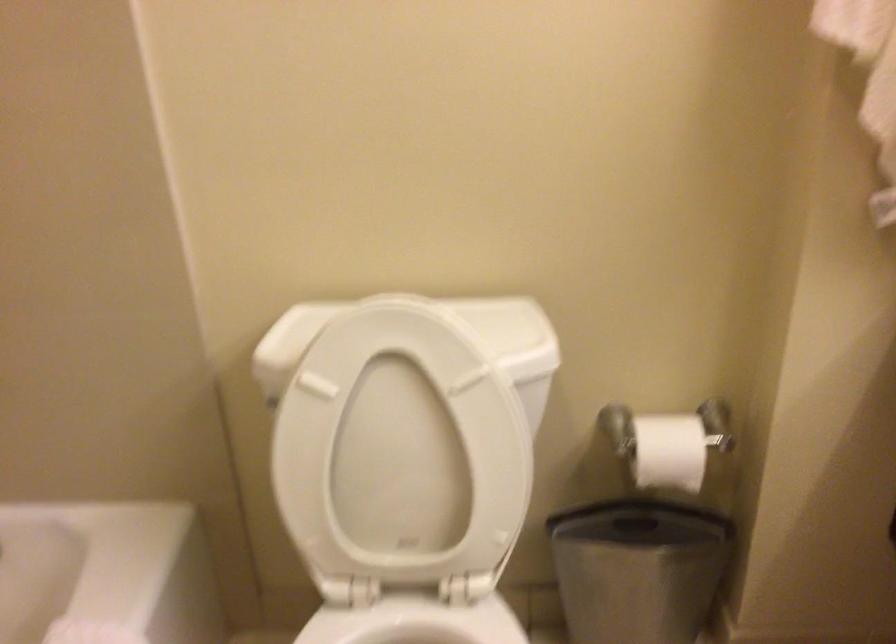
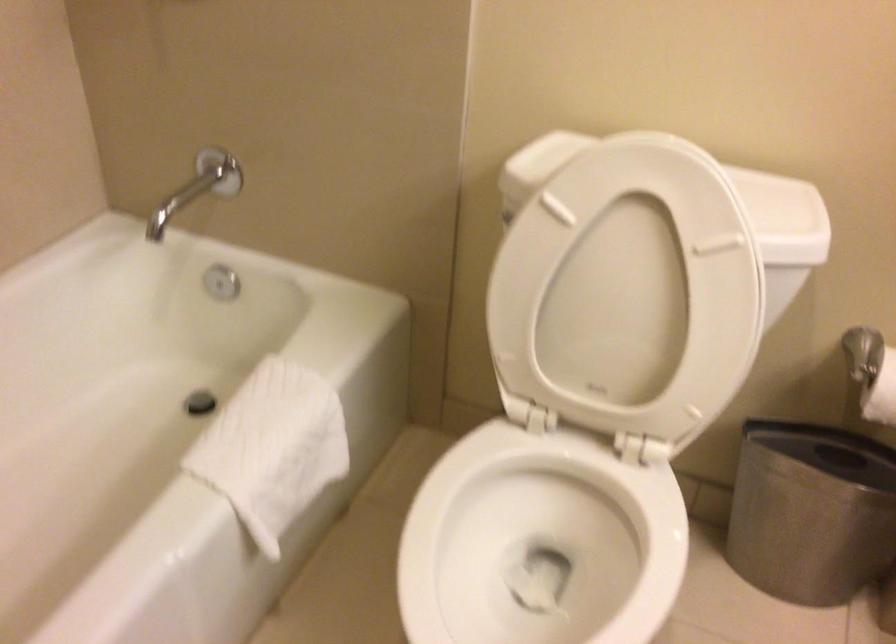
Question: What movement of the cameraman would produce the second image?

Choices:
 (A) Left
 (B) Right
 (C) Forward
 (D) Backward

Answer: (C)